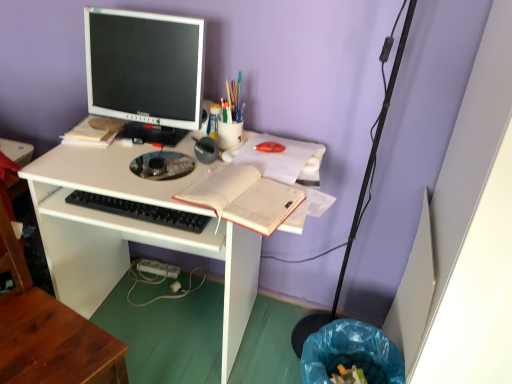
Identify the location of vacant area that is situated to the right of white plastic power plugs and sockets at lower center. (194, 292).